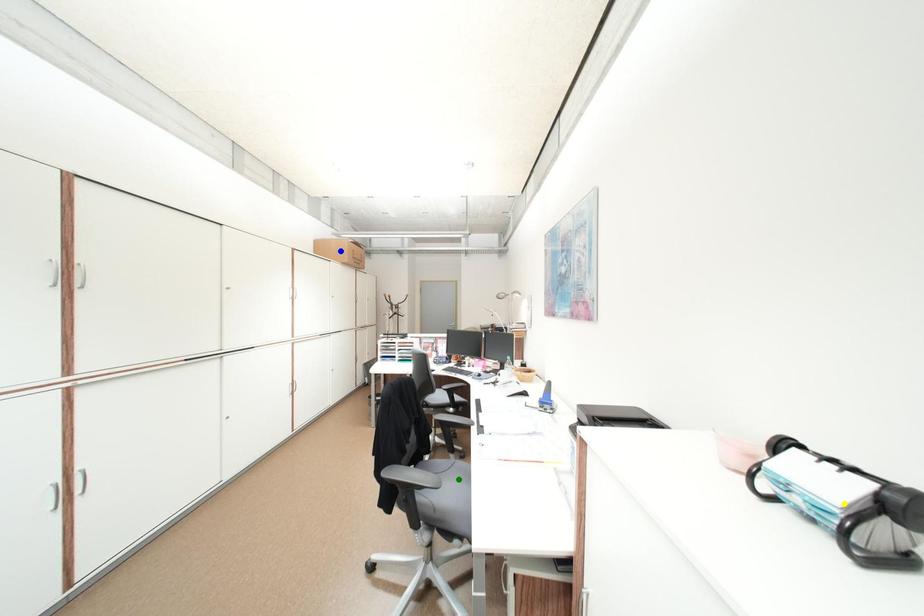
Order these from nearest to farthest:
blue point, yellow point, green point

1. yellow point
2. green point
3. blue point